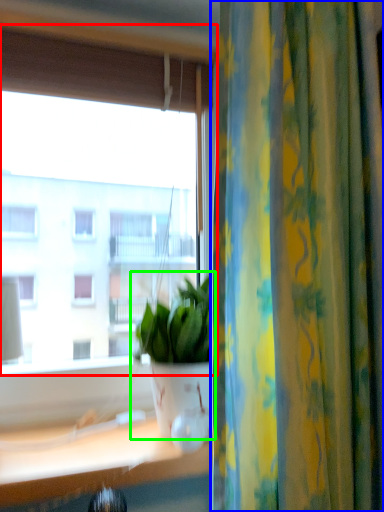
Question: Which object is the closest to the window (highlighted by a red box)? Choose among these: curtain (highlighted by a blue box) or houseplant (highlighted by a green box).

Choices:
 (A) curtain
 (B) houseplant

Answer: (B)